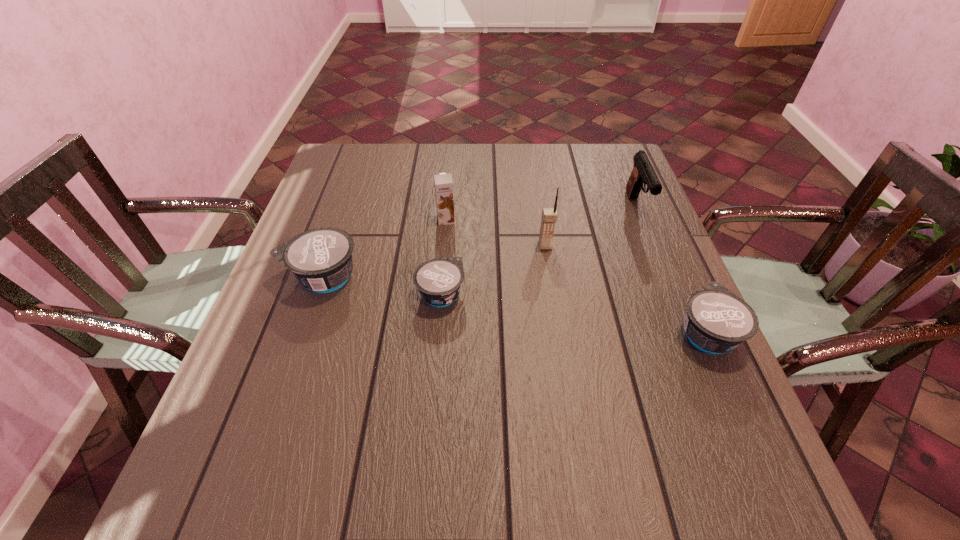
If equal spacing is the goal by inserting an additional yogurt among them, please point out a vacant space for this new yogurt. Please provide its 2D coordinates. Your answer should be formatted as a tuple, i.e. [(x, y)], where the tuple contains the x and y coordinates of a point satisfying the conditions above.

[(568, 313)]